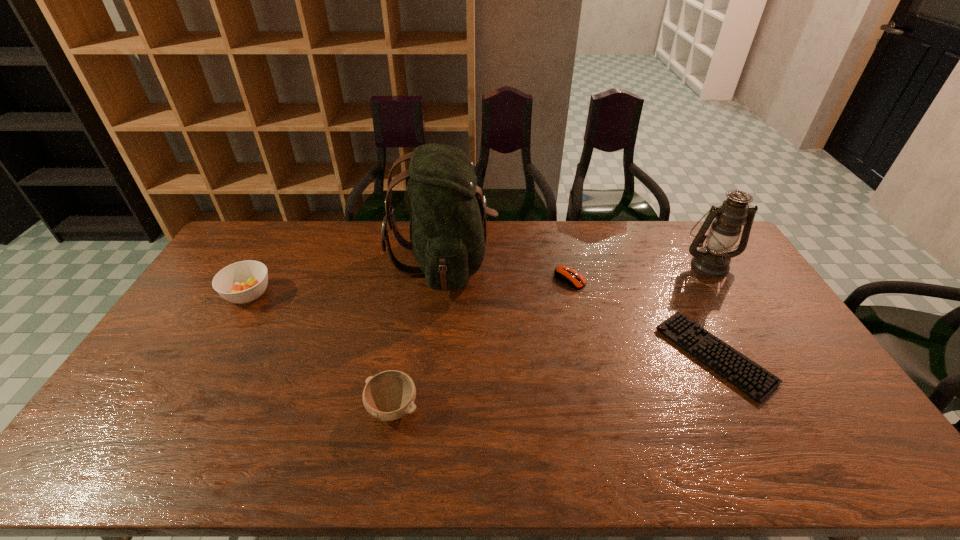
I want to click on vacant area situated 0.340m on the left of the bowl, so click(x=237, y=408).

The height and width of the screenshot is (540, 960). Identify the location of free space located on the back of the fifth tallest object. (559, 232).

Where is `free space located 0.180m on the left of the shortest object`? The height and width of the screenshot is (540, 960). free space located 0.180m on the left of the shortest object is located at coordinates (603, 355).

Identify the location of backpack at the far edge. The width and height of the screenshot is (960, 540). (448, 230).

Locate an element on the screen. oil lamp that is positioned at the far edge is located at coordinates (713, 260).

At what (x,y) coordinates should I click in order to perform the action: click on object that is at the left edge. Please return your answer as a coordinate pair (x, y). This screenshot has width=960, height=540. Looking at the image, I should click on (241, 282).

Locate an element on the screen. The width and height of the screenshot is (960, 540). oil lamp located at the right edge is located at coordinates coord(713,260).

Locate an element on the screen. computer keyboard that is positioned at the right edge is located at coordinates point(746,375).

Where is `object that is at the far right corner`? This screenshot has width=960, height=540. object that is at the far right corner is located at coordinates (713, 260).

The image size is (960, 540). I want to click on free space at the far edge, so click(x=512, y=231).